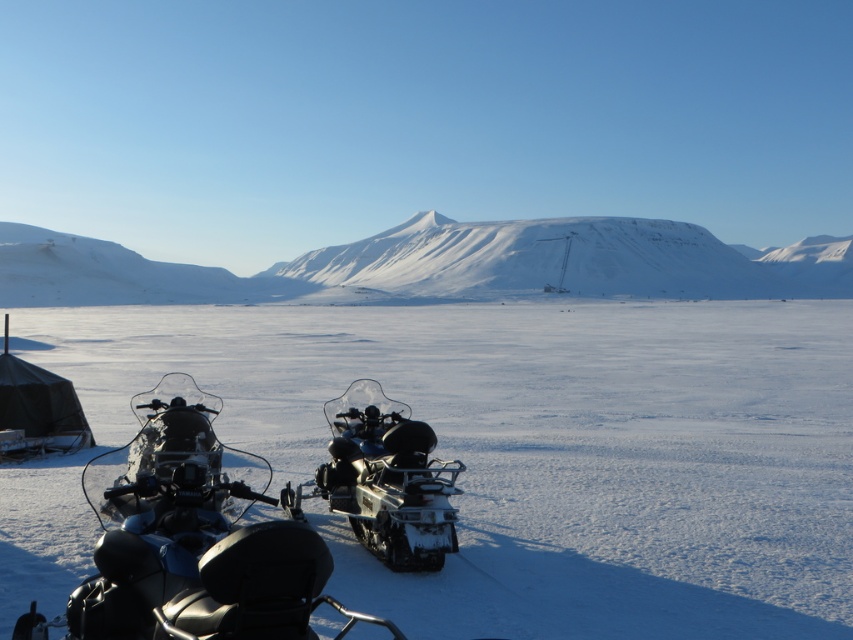
You are planning to park your new motorcycle in the winter landscape shown. The motorcycle is slightly larger than the black rubber snowmobile at center. Will it fit on the white matte snow at center without overlapping the snowmobile?

The white matte snow at center is bigger than the black rubber snowmobile at center. Since your motorcycle is only slightly larger than the snowmobile, it should fit on the white matte snow at center as long as it is positioned appropriately to avoid overlapping the snowmobile.

You are planning a snowmobile tour and see the snowy white mountain at center and the black matte snowmobile at center in the image. Which object is higher in elevation?

The snowy white mountain at center is positioned over the black matte snowmobile at center, so it is higher in elevation.